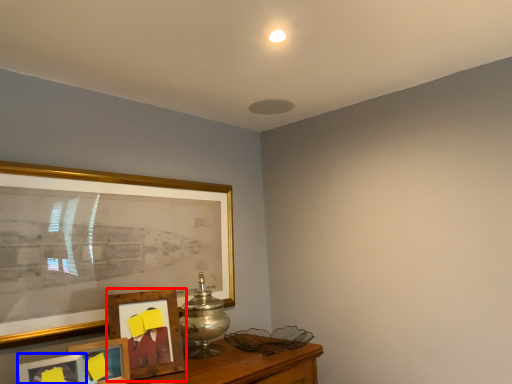
Question: Which object is further to the camera taking this photo, picture frame (highlighted by a red box) or picture frame (highlighted by a blue box)?

Choices:
 (A) picture frame
 (B) picture frame

Answer: (A)